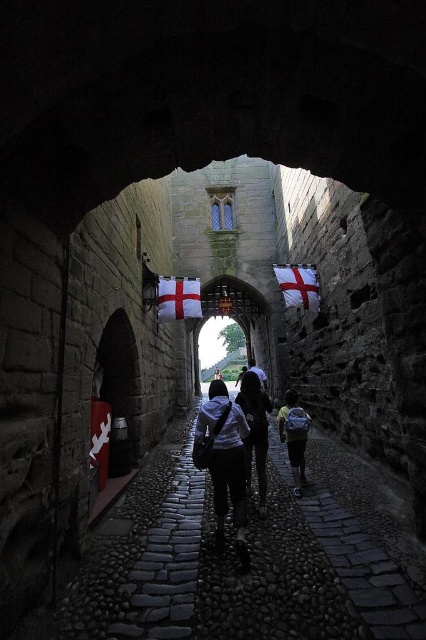
Between light blue backpack at center and white cotton flag at upper center, which one is positioned lower?

light blue backpack at center

Which of these two, light blue backpack at center or white cotton flag at upper center, stands shorter?

light blue backpack at center

The image size is (426, 640). Identify the location of light blue backpack at center. (293, 436).

Between point (181, 301) and point (252, 369), which one is positioned behind?

Positioned behind is point (252, 369).

Who is more distant from viewer, [192,307] or [265,385]?

The point [265,385] is more distant.

Where is `white fabric flag at center`? white fabric flag at center is located at coordinates (178, 298).

Can you confirm if dark blue jeans at center is positioned above light blue backpack at center?

Indeed, dark blue jeans at center is positioned over light blue backpack at center.

I want to click on dark blue jeans at center, so click(255, 432).